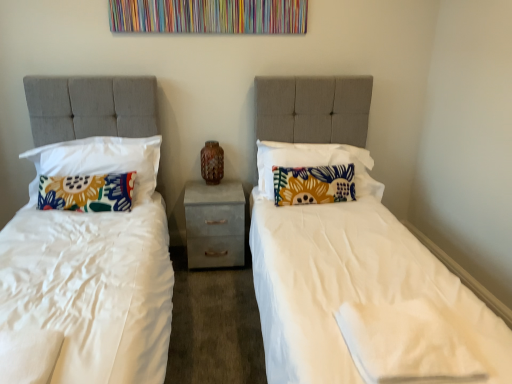
Question: Is floral fabric pillow at center, which is the second pillow in right-to-left order, located within brown textured vase at center?

Choices:
 (A) no
 (B) yes

Answer: (A)

Question: From a real-world perspective, does brown textured vase at center stand above floral fabric pillow at center, which is the second pillow in right-to-left order?

Choices:
 (A) yes
 (B) no

Answer: (A)

Question: From the image's perspective, is brown textured vase at center above floral fabric pillow at center, which is the third pillow in left-to-right order?

Choices:
 (A) yes
 (B) no

Answer: (A)

Question: Can you confirm if brown textured vase at center is smaller than floral fabric pillow at center, which is the third pillow in left-to-right order?

Choices:
 (A) yes
 (B) no

Answer: (A)

Question: Does brown textured vase at center have a larger size compared to floral fabric pillow at center, which is the second pillow in right-to-left order?

Choices:
 (A) no
 (B) yes

Answer: (A)

Question: From a real-world perspective, is brown textured vase at center physically below floral fabric pillow at center, which is the second pillow in right-to-left order?

Choices:
 (A) no
 (B) yes

Answer: (A)

Question: Can you confirm if floral fabric pillow at center, which is the first pillow in right-to-left order, is taller than floral fabric pillow at left, marked as the first pillow in a left-to-right arrangement?

Choices:
 (A) no
 (B) yes

Answer: (B)

Question: Is floral fabric pillow at center, which is the first pillow in right-to-left order, positioned beyond the bounds of floral fabric pillow at left, marked as the first pillow in a left-to-right arrangement?

Choices:
 (A) no
 (B) yes

Answer: (B)

Question: Is floral fabric pillow at center, acting as the 4th pillow starting from the left, aimed at floral fabric pillow at left, marked as the first pillow in a left-to-right arrangement?

Choices:
 (A) yes
 (B) no

Answer: (B)

Question: Is floral fabric pillow at center, acting as the 4th pillow starting from the left, touching floral fabric pillow at left, marked as the first pillow in a left-to-right arrangement?

Choices:
 (A) no
 (B) yes

Answer: (A)

Question: Is floral fabric pillow at center, which is the first pillow in right-to-left order, wider than floral fabric pillow at left, which is counted as the 4th pillow, starting from the right?

Choices:
 (A) no
 (B) yes

Answer: (B)

Question: From a real-world perspective, is floral fabric pillow at center, which is the first pillow in right-to-left order, over floral fabric pillow at left, marked as the first pillow in a left-to-right arrangement?

Choices:
 (A) no
 (B) yes

Answer: (B)

Question: Is floral fabric pillow at center, which is the second pillow in right-to-left order, taller than brown textured vase at center?

Choices:
 (A) yes
 (B) no

Answer: (A)